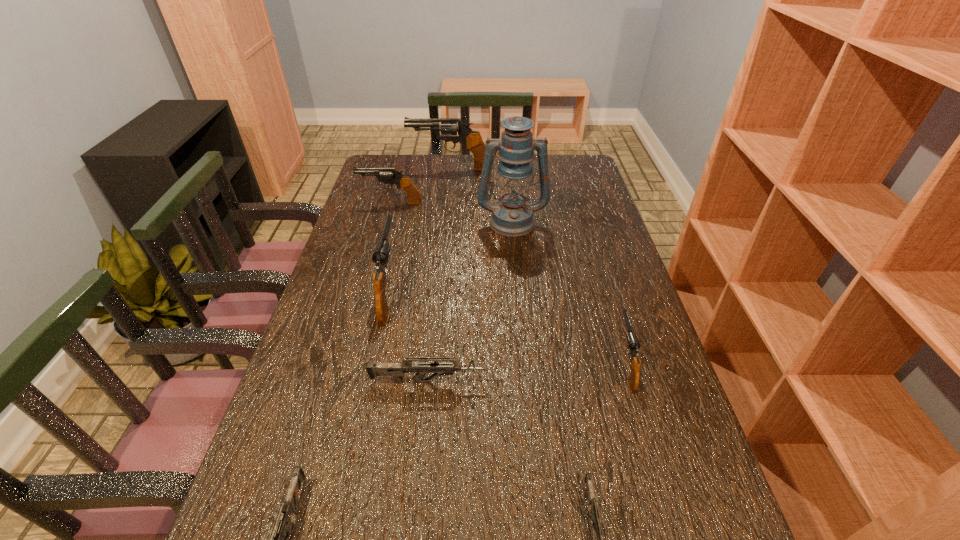
Locate an element on the screen. the tallest object is located at coordinates tap(512, 216).

Where is `lantern`? This screenshot has height=540, width=960. lantern is located at coordinates (512, 216).

Locate an element on the screen. the farthest black gun is located at coordinates (472, 140).

At what (x,y) coordinates should I click in order to perform the action: click on the farthest object. Please return your answer as a coordinate pair (x, y). The image size is (960, 540). Looking at the image, I should click on (472, 140).

This screenshot has height=540, width=960. I want to click on the second tallest gun, so click(x=382, y=249).

Locate an element on the screen. the second nearest black gun is located at coordinates (382, 249).

At what (x,y) coordinates should I click in order to perform the action: click on the second farthest gun. Please return your answer as a coordinate pair (x, y). Looking at the image, I should click on (386, 175).

This screenshot has width=960, height=540. I want to click on the fifth shortest gun, so click(x=386, y=175).

I want to click on the fourth shortest gun, so click(633, 344).

In order to click on the smallest black gun in this screenshot , I will do click(x=633, y=344).